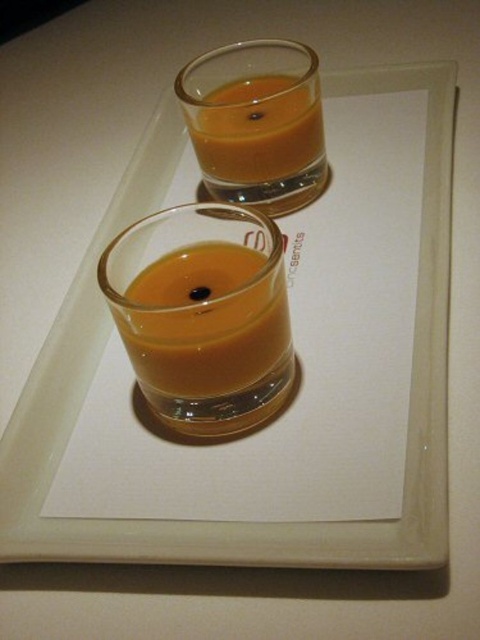
You are a customer at a dessert bar and see two points on the tray where the cups are placed. The points are labeled as point (181, 269) and point (311, 125). From your perspective, which point is closer to you?

Point (181, 269) is in front of point (311, 125), so it is closer to you.

You are a food stylist arranging desserts on a tray. You have two items to place on the tray, the matte orange liquid at center and the matte glass at upper center. Based on their widths, which item should you place first to ensure proper spacing?

The matte orange liquid at center has a smaller width than the matte glass at upper center. Therefore, you should place the matte glass at upper center first to allow enough space for the narrower liquid container.